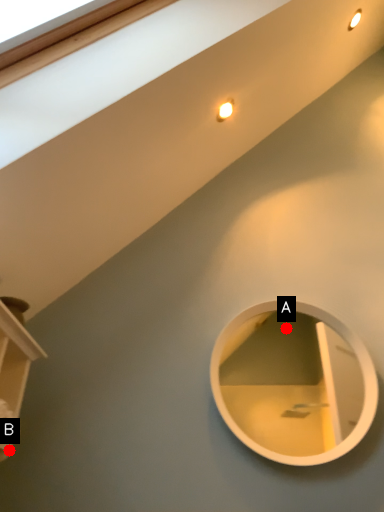
Question: Two points are circled on the image, labeled by A and B beside each circle. Which point appears closest to the camera in this image?

Choices:
 (A) A is closer
 (B) B is closer

Answer: (B)